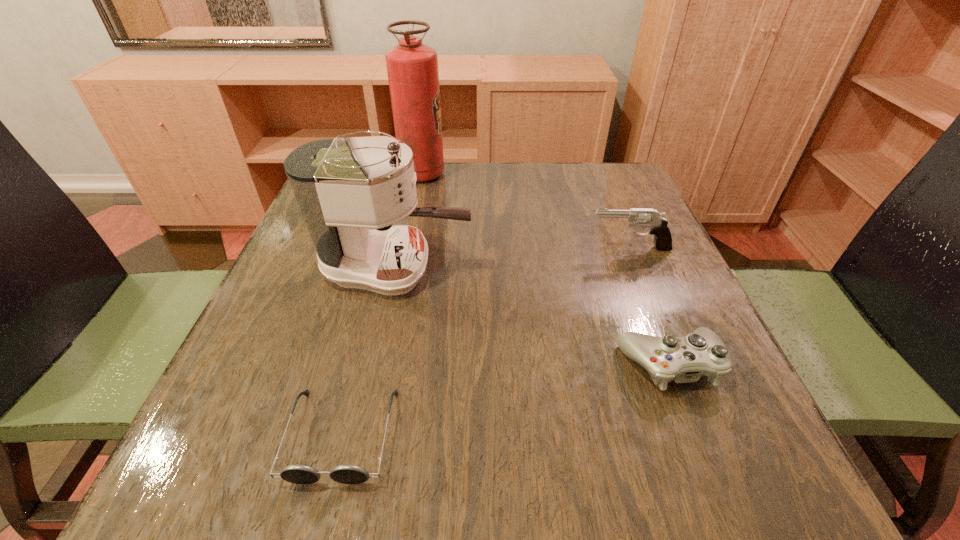
This screenshot has width=960, height=540. I want to click on vacant position located 0.390m at the muzzle of the third shortest object, so click(409, 248).

Find the location of a particular element. The image size is (960, 540). vacant space located 0.400m on the left of the control is located at coordinates (377, 364).

Find the location of `object that is positioned at the far edge`. object that is positioned at the far edge is located at coordinates (412, 67).

Locate an element on the screen. object that is at the near edge is located at coordinates (298, 474).

The width and height of the screenshot is (960, 540). Find the location of `coffee maker that is at the left edge`. coffee maker that is at the left edge is located at coordinates (344, 187).

Identify the location of sunglasses that is positioned at the left edge. The width and height of the screenshot is (960, 540). (298, 474).

Locate an element on the screen. Image resolution: width=960 pixels, height=540 pixels. gun situated at the right edge is located at coordinates (644, 217).

Locate an element on the screen. Image resolution: width=960 pixels, height=540 pixels. control positioned at the right edge is located at coordinates (684, 359).

Where is `object present at the near left corner`? Image resolution: width=960 pixels, height=540 pixels. object present at the near left corner is located at coordinates (298, 474).

The image size is (960, 540). I want to click on free location at the far edge of the desktop, so click(472, 166).